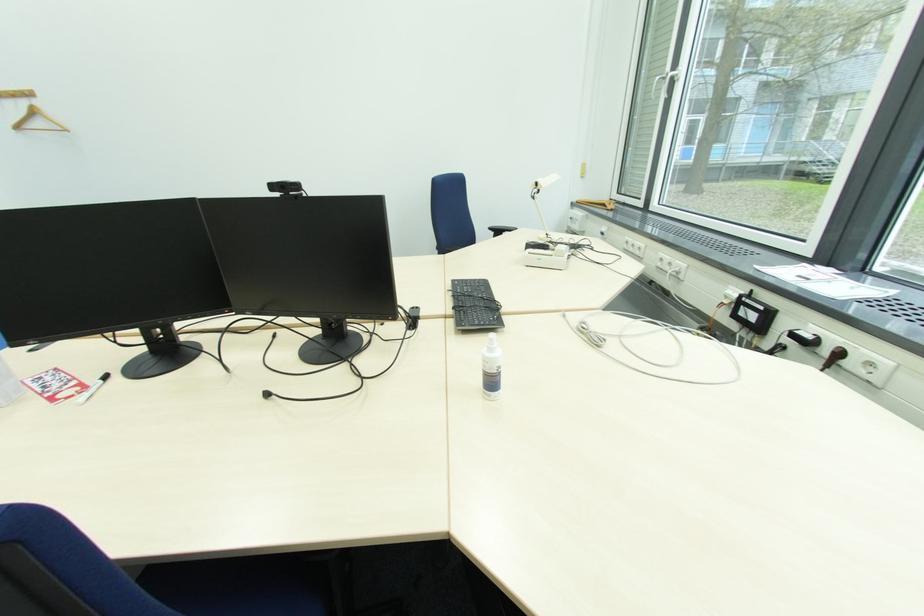
The image size is (924, 616). Identify the location of white spray bottle. (491, 368).